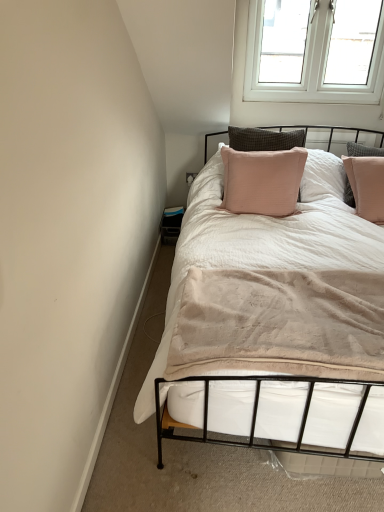
Question: Is white soft bed at center completely or partially inside pink fabric pillow at upper center?

Choices:
 (A) yes
 (B) no

Answer: (B)

Question: Is pink fabric pillow at upper center to the left of white soft bed at center from the viewer's perspective?

Choices:
 (A) no
 (B) yes

Answer: (B)

Question: Is pink fabric pillow at upper center facing towards white soft bed at center?

Choices:
 (A) no
 (B) yes

Answer: (A)

Question: Are pink fabric pillow at upper center and white soft bed at center making contact?

Choices:
 (A) no
 (B) yes

Answer: (A)

Question: Is white soft bed at center at the back of pink fabric pillow at upper center?

Choices:
 (A) yes
 (B) no

Answer: (B)

Question: Is point (359, 129) closer or farther from the camera than point (314, 17)?

Choices:
 (A) farther
 (B) closer

Answer: (A)

Question: In terms of size, does pink fabric pillow at upper center appear bigger or smaller than white plastic window at upper right?

Choices:
 (A) big
 (B) small

Answer: (A)

Question: From their relative heights in the image, would you say pink fabric pillow at upper center is taller or shorter than white plastic window at upper right?

Choices:
 (A) tall
 (B) short

Answer: (A)

Question: In the image, is pink fabric pillow at upper center positioned in front of or behind white plastic window at upper right?

Choices:
 (A) behind
 (B) front

Answer: (B)

Question: Which is correct: white soft bed at center is inside white plastic window at upper right, or outside of it?

Choices:
 (A) inside
 (B) outside

Answer: (B)

Question: Based on their positions, is white soft bed at center located to the left or right of white plastic window at upper right?

Choices:
 (A) left
 (B) right

Answer: (A)

Question: From the image's perspective, relative to white plastic window at upper right, is white soft bed at center above or below?

Choices:
 (A) below
 (B) above

Answer: (A)

Question: Based on their sizes in the image, would you say white soft bed at center is bigger or smaller than white plastic window at upper right?

Choices:
 (A) small
 (B) big

Answer: (B)

Question: Do you think white soft bed at center is within pink fabric pillow at upper center, or outside of it?

Choices:
 (A) outside
 (B) inside

Answer: (A)

Question: Visually, is white soft bed at center positioned to the left or to the right of pink fabric pillow at upper center?

Choices:
 (A) right
 (B) left

Answer: (A)